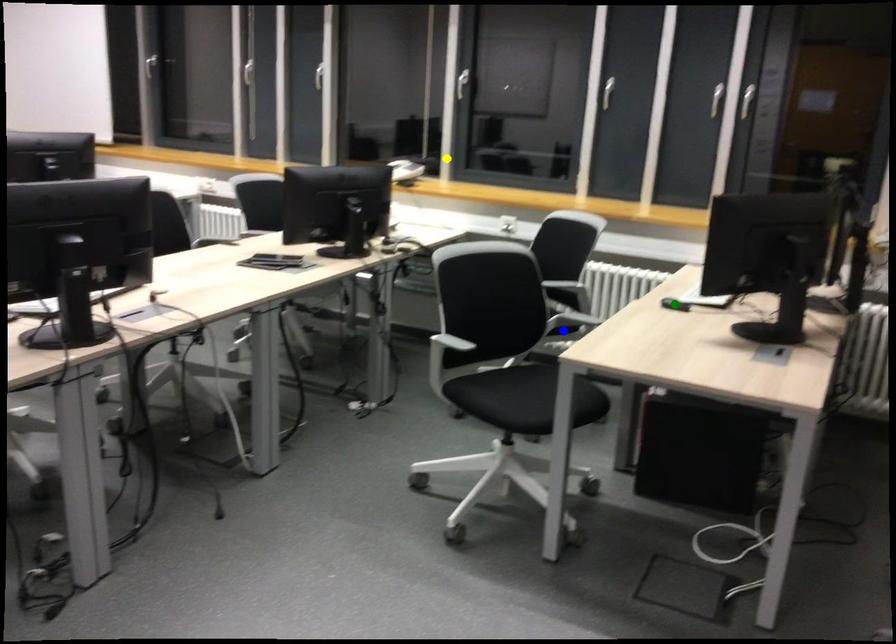
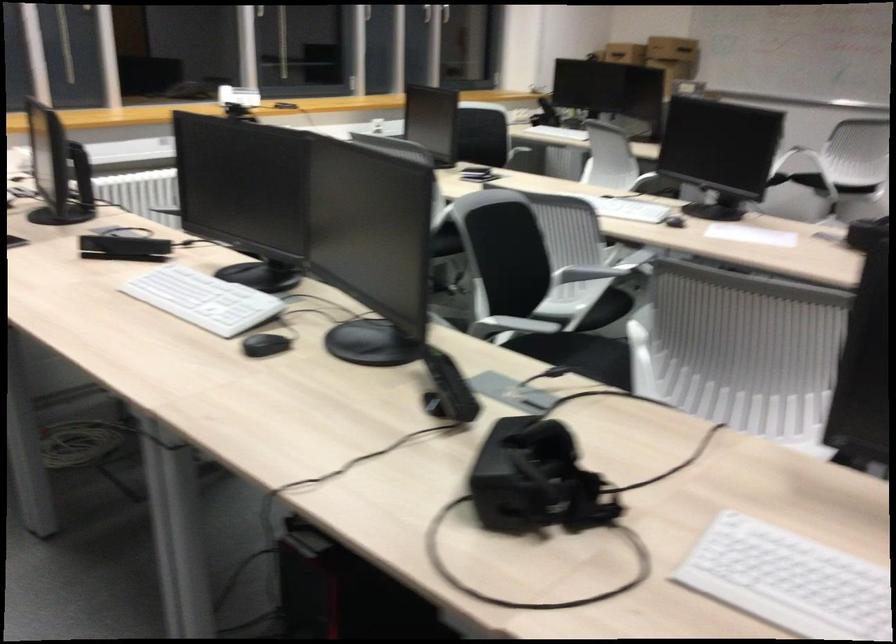
I am providing you with two images of the same scene from different viewpoints. Three points are marked in image1. Which point corresponds to a part or object that is occluded in image2?In image1, three points are marked. Which of them correspond to a part or object that is occluded in image2?Among the three points shown in image1, which one corresponds to a part or object that is no longer visible due to occlusion in image2?

blue point, green point